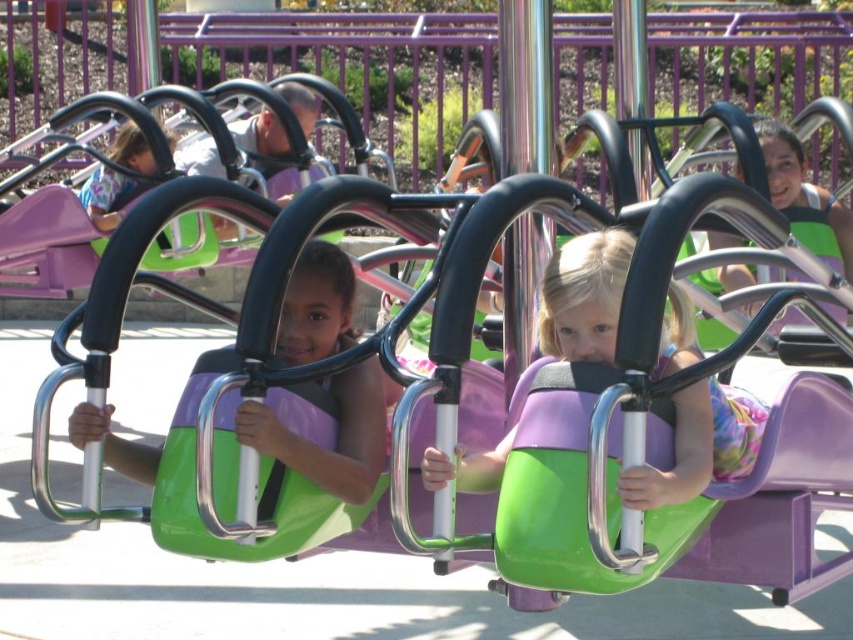
Can you confirm if matte green seat at center is shorter than matte green helmet at center?

Yes.

How far apart are matte green seat at center and matte green helmet at center?

matte green seat at center is 10.09 meters away from matte green helmet at center.

Who is more forward, (259, 448) or (148, 168)?

Point (259, 448) is in front.

Where is `matte green seat at center`? This screenshot has height=640, width=853. matte green seat at center is located at coordinates (337, 435).

Describe the element at coordinates (584, 296) in the screenshot. I see `matte purple helmet at center` at that location.

Is matte purple helmet at center bigger than matte green helmet at center?

No.

Where is `matte purple helmet at center`? Image resolution: width=853 pixels, height=640 pixels. matte purple helmet at center is located at coordinates (584, 296).

The width and height of the screenshot is (853, 640). Identify the location of matte purple helmet at center. (584, 296).

In the scene shown: Does matte green seat at center have a larger size compared to matte purple helmet at center?

Yes, matte green seat at center is bigger than matte purple helmet at center.

Is matte green seat at center positioned in front of matte purple helmet at center?

No.

Does point (358, 422) come in front of point (697, 401)?

No.

Image resolution: width=853 pixels, height=640 pixels. I want to click on matte green seat at center, so click(337, 435).